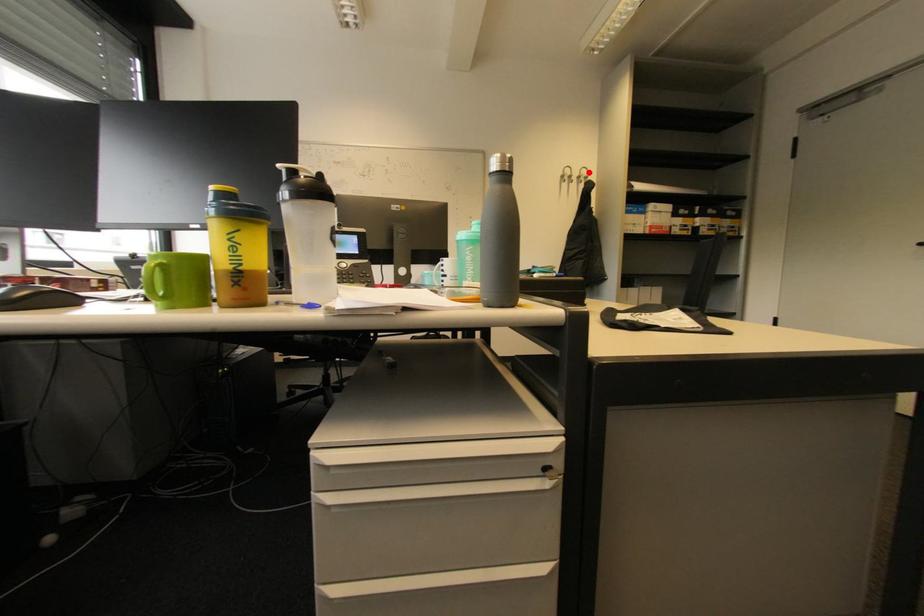
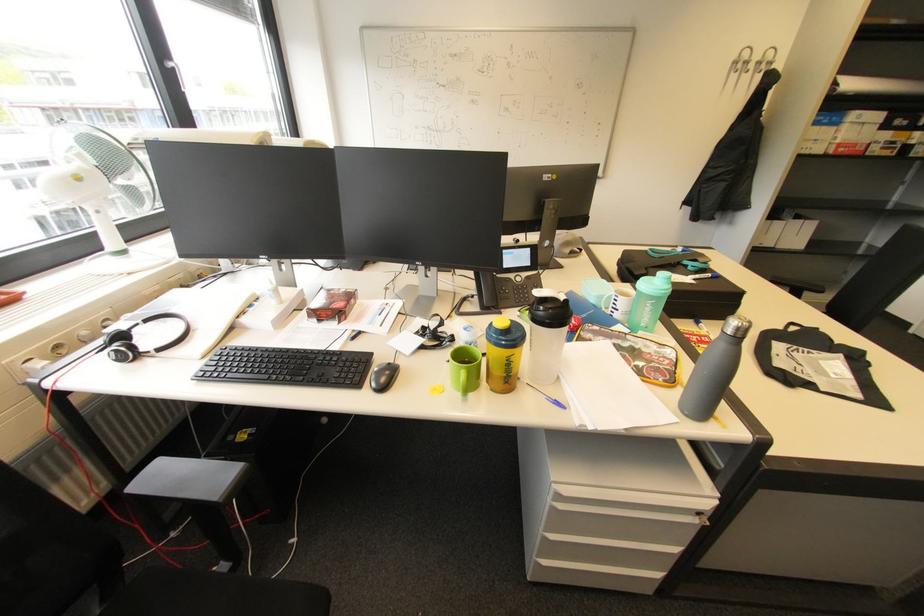
In the second image, find the point that corresponds to the highlighted location in the first image.

(775, 55)